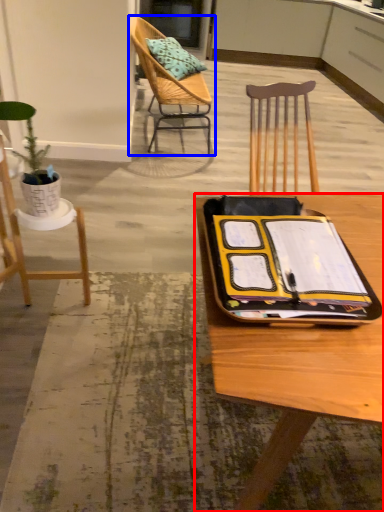
Question: Which point is closer to the camera, desk (highlighted by a red box) or chair (highlighted by a blue box)?

Choices:
 (A) desk
 (B) chair

Answer: (A)